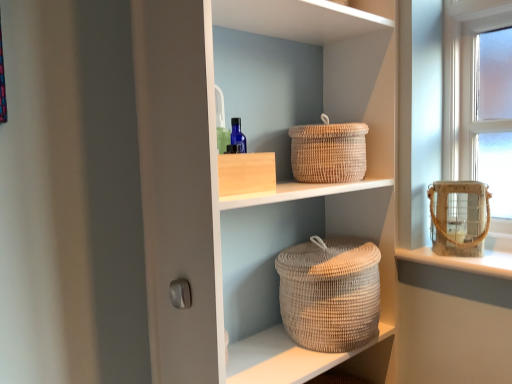
Question: Which direction should I rotate to face neutral woven basket at center, positioned as the second basket container in top-to-bottom order, — up or down?

Choices:
 (A) up
 (B) down

Answer: (B)

Question: Is natural woven basket at upper center with neutral woven basket at center, marked as the 1th basket container in a bottom-to-top arrangement?

Choices:
 (A) no
 (B) yes

Answer: (A)

Question: Can you confirm if natural woven basket at upper center is taller than neutral woven basket at center, which is counted as the 2th basket container, starting from the right?

Choices:
 (A) no
 (B) yes

Answer: (A)

Question: Is there a large distance between natural woven basket at upper center and neutral woven basket at center, marked as the 1th basket container in a bottom-to-top arrangement?

Choices:
 (A) yes
 (B) no

Answer: (B)

Question: Considering the relative sizes of natural woven basket at upper center and neutral woven basket at center, which is counted as the 2th basket container, starting from the right, in the image provided, is natural woven basket at upper center wider than neutral woven basket at center, which is counted as the 2th basket container, starting from the right,?

Choices:
 (A) yes
 (B) no

Answer: (B)

Question: From a real-world perspective, is natural woven basket at upper center positioned under neutral woven basket at center, positioned as the second basket container in top-to-bottom order, based on gravity?

Choices:
 (A) no
 (B) yes

Answer: (A)

Question: Does natural woven basket at upper center have a larger size compared to neutral woven basket at center, which is the first basket container from left to right?

Choices:
 (A) no
 (B) yes

Answer: (A)

Question: Considering the relative sizes of rustic woven basket at right, which is counted as the first basket container, starting from the top, and neutral woven basket at center, positioned as the second basket container in top-to-bottom order, in the image provided, is rustic woven basket at right, which is counted as the first basket container, starting from the top, shorter than neutral woven basket at center, positioned as the second basket container in top-to-bottom order,?

Choices:
 (A) no
 (B) yes

Answer: (B)

Question: From a real-world perspective, is rustic woven basket at right, which is counted as the first basket container, starting from the top, positioned over neutral woven basket at center, which is the first basket container from left to right, based on gravity?

Choices:
 (A) no
 (B) yes

Answer: (B)

Question: Is neutral woven basket at center, positioned as the second basket container in top-to-bottom order, located within rustic woven basket at right, the 2th basket container when ordered from bottom to top?

Choices:
 (A) no
 (B) yes

Answer: (A)

Question: From a real-world perspective, is rustic woven basket at right, which is counted as the 1th basket container, starting from the right, under neutral woven basket at center, positioned as the second basket container in top-to-bottom order?

Choices:
 (A) yes
 (B) no

Answer: (B)

Question: Is rustic woven basket at right, which is counted as the 1th basket container, starting from the right, facing towards neutral woven basket at center, positioned as the second basket container in top-to-bottom order?

Choices:
 (A) no
 (B) yes

Answer: (A)

Question: Does rustic woven basket at right, which is counted as the first basket container, starting from the top, have a larger size compared to neutral woven basket at center, which is the first basket container from left to right?

Choices:
 (A) yes
 (B) no

Answer: (B)

Question: Can you confirm if natural woven basket at center is wider than white glossy door handle at lower left?

Choices:
 (A) no
 (B) yes

Answer: (B)